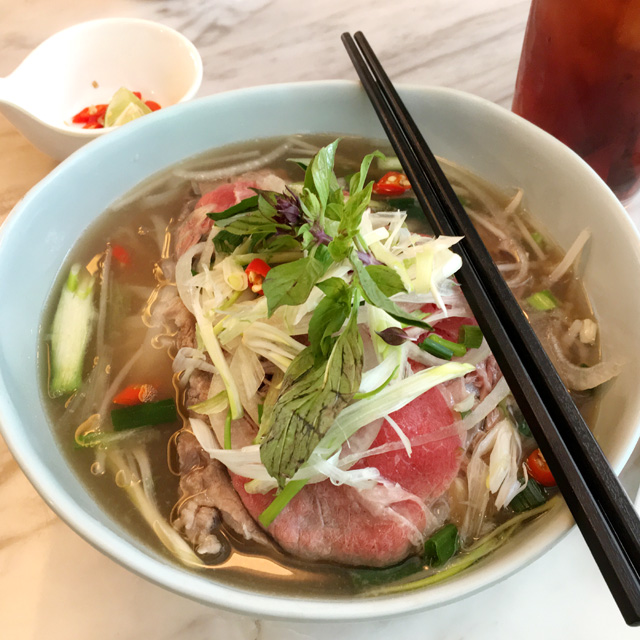
This screenshot has width=640, height=640. I want to click on the smaller bowl, so click(118, 43).